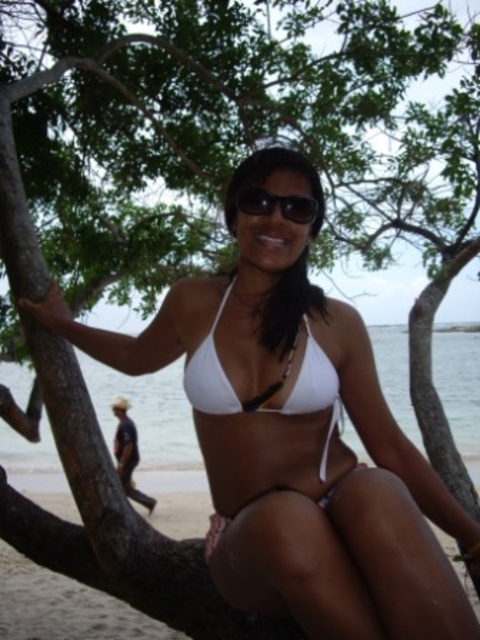
Does white matte bikini at center have a lesser width compared to white matte bikini top at center?

No.

Is point (307, 609) positioned before point (223, 392)?

That is True.

At what (x,y) coordinates should I click in order to perform the action: click on white matte bikini at center. Please return your answer as a coordinate pair (x, y). This screenshot has height=640, width=480. Looking at the image, I should click on (300, 442).

Is white matte bikini at center smaller than white fabric bikini bottom at lower center?

Actually, white matte bikini at center might be larger than white fabric bikini bottom at lower center.

Who is lower down, white matte bikini at center or white fabric bikini bottom at lower center?

white fabric bikini bottom at lower center

Is point (264, 232) behind point (167, 554)?

No, (264, 232) is in front of (167, 554).

Locate an element on the screen. The width and height of the screenshot is (480, 640). white matte bikini at center is located at coordinates (300, 442).

Which is more to the right, white matte bikini at center or black plastic sunglasses at center?

black plastic sunglasses at center

Where is `white matte bikini at center`? white matte bikini at center is located at coordinates (300, 442).

You are a GUI agent. You are given a task and a screenshot of the screen. Output one action in this format:
    pyautogui.click(x=<x>, y=<y>)
    Task: Click on the white matte bikini at center
    The width and height of the screenshot is (480, 640).
    Given the screenshot: What is the action you would take?
    pyautogui.click(x=300, y=442)